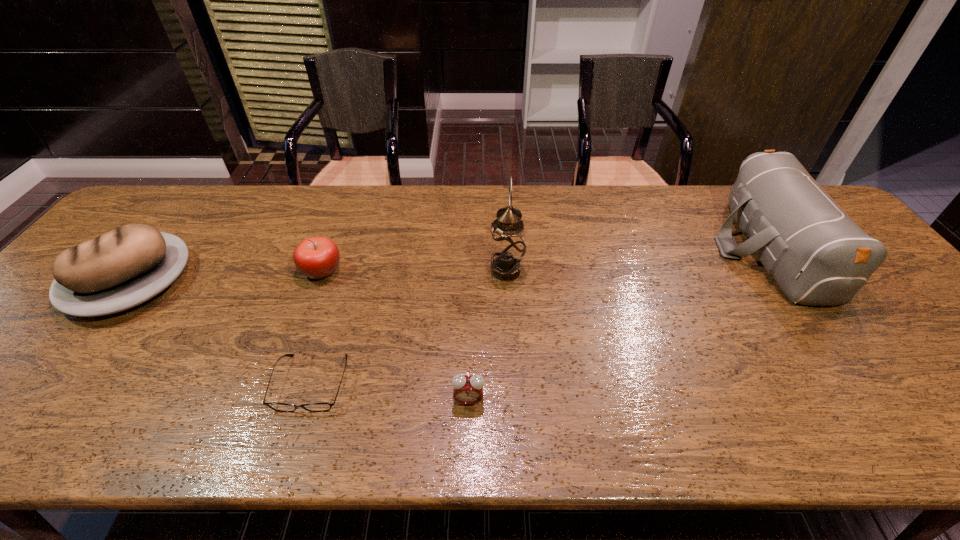
Where is `vacant space located 0.120m on the left of the tallest object`? The width and height of the screenshot is (960, 540). vacant space located 0.120m on the left of the tallest object is located at coordinates (444, 271).

Identify the location of vacant area situated 0.170m on the left of the rightmost object. The width and height of the screenshot is (960, 540). (657, 248).

Find the location of a particular element. vacant area situated 0.150m on the front of the bread is located at coordinates (52, 382).

Where is `vacant space positioned 0.290m on the back of the apple`? Image resolution: width=960 pixels, height=540 pixels. vacant space positioned 0.290m on the back of the apple is located at coordinates (348, 197).

The height and width of the screenshot is (540, 960). I want to click on blank space located on the clock face of the fourth object from left to right, so click(468, 446).

Locate an element on the screen. The height and width of the screenshot is (540, 960). object present at the far edge is located at coordinates (817, 254).

Identify the location of alarm clock located in the near edge section of the desktop. (467, 389).

Where is `spectacles that is at the near edge`? Image resolution: width=960 pixels, height=540 pixels. spectacles that is at the near edge is located at coordinates (283, 407).

You are a GUI agent. You are given a task and a screenshot of the screen. Output one action in this format:
    pyautogui.click(x=<x>, y=<y>)
    Task: Click on the object that is at the left edge
    This screenshot has height=540, width=960.
    Given the screenshot: What is the action you would take?
    pyautogui.click(x=127, y=266)

What are the coordinates of `object that is at the right edge` in the screenshot? It's located at (817, 254).